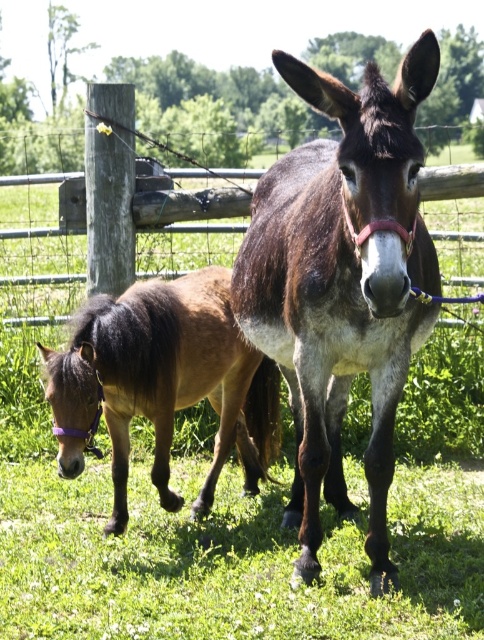
You are a farmer checking the field. You need to know which animal is wider between the brown fuzzy mule at center and the brown fuzzy pony at lower left to decide which one can fit through a narrow gate. Which one is narrower?

The brown fuzzy mule at center is narrower than the brown fuzzy pony at lower left, so it can fit through the narrow gate.

You are a farmer checking the distance between the brown fuzzy mule at center and the brown fuzzy pony at lower left. You need to ensure they are at least 30 inches apart for their safety. Based on the image, are they within the required distance?

The brown fuzzy mule at center and brown fuzzy pony at lower left are 30.03 inches apart, which is just over the minimum required distance of 30 inches. Therefore, they are within the safe distance requirement.